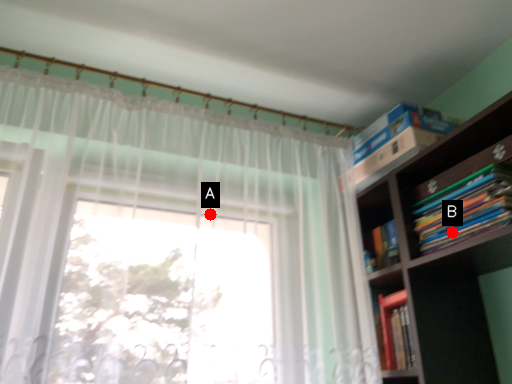
Question: Two points are circled on the image, labeled by A and B beside each circle. Which point is closer to the camera?

Choices:
 (A) A is closer
 (B) B is closer

Answer: (B)